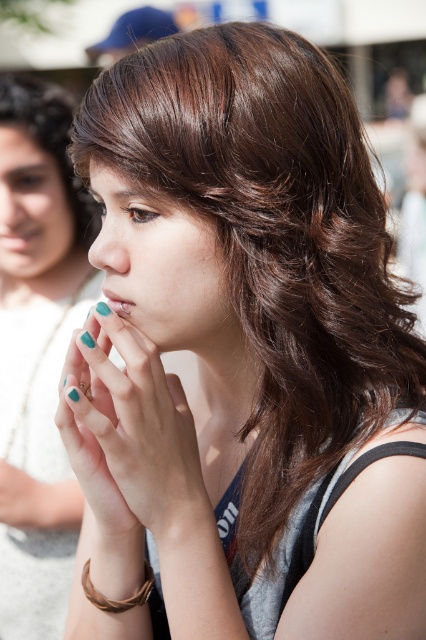
Who is higher up, brown woven bracelet at lower left or teal matte nails at lower left?

teal matte nails at lower left

Does brown woven bracelet at lower left appear under teal matte nails at lower left?

Indeed, brown woven bracelet at lower left is positioned under teal matte nails at lower left.

Is point (144, 586) less distant than point (124, 310)?

No, it is not.

Where is `brown woven bracelet at lower left`? The height and width of the screenshot is (640, 426). brown woven bracelet at lower left is located at coordinates (118, 600).

Who is positioned more to the right, teal nail polish at center or teal matte nails at left?

teal matte nails at left is more to the right.

Does teal nail polish at center have a lesser width compared to teal matte nails at left?

No, teal nail polish at center is not thinner than teal matte nails at left.

Does point (13, 344) lie behind point (60, 164)?

Yes, point (13, 344) is behind point (60, 164).

Identify the location of teal nail polish at center. (39, 356).

Can you confirm if teal nail polish at center is bigger than teal polished nails at center?

Yes, teal nail polish at center is bigger than teal polished nails at center.

Who is more forward, (5, 282) or (137, 355)?

Positioned in front is point (137, 355).

You are a GUI agent. You are given a task and a screenshot of the screen. Output one action in this format:
    pyautogui.click(x=<x>, y=<y>)
    Task: Click on the teal nail polish at center
    This screenshot has height=640, width=426.
    Given the screenshot: What is the action you would take?
    pyautogui.click(x=39, y=356)